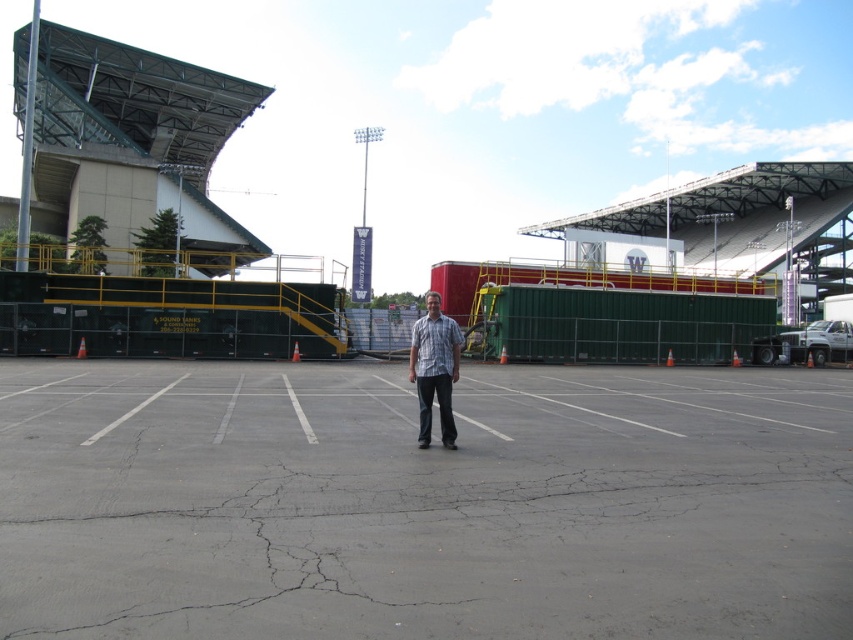
Question: Does gray asphalt parking lot at center have a greater width compared to plaid shirt at center?

Choices:
 (A) yes
 (B) no

Answer: (A)

Question: Which point is closer to the camera?

Choices:
 (A) plaid shirt at center
 (B) gray asphalt parking lot at center

Answer: (B)

Question: Can you confirm if gray asphalt parking lot at center is positioned to the right of plaid shirt at center?

Choices:
 (A) yes
 (B) no

Answer: (B)

Question: Can you confirm if gray asphalt parking lot at center is bigger than plaid shirt at center?

Choices:
 (A) yes
 (B) no

Answer: (A)

Question: Which object is closer to the camera taking this photo?

Choices:
 (A) gray asphalt parking lot at center
 (B) plaid shirt at center

Answer: (A)